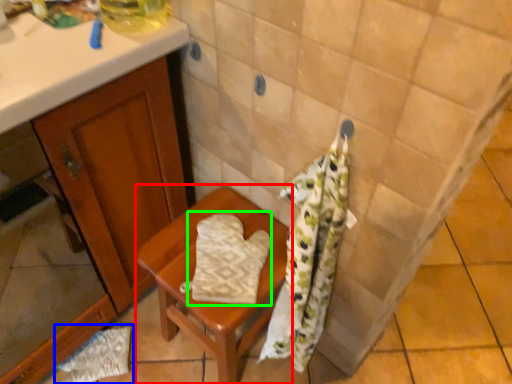
Question: Estimate the real-world distances between objects in this image. Which object is closer to furniture (highlighted by a red box), material (highlighted by a blue box) or beach towel (highlighted by a green box)?

Choices:
 (A) material
 (B) beach towel

Answer: (B)